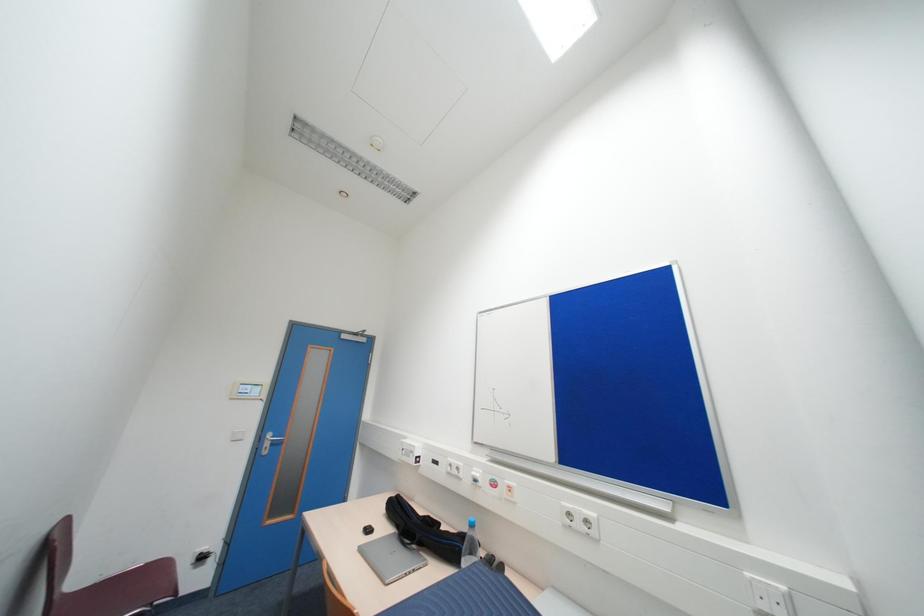
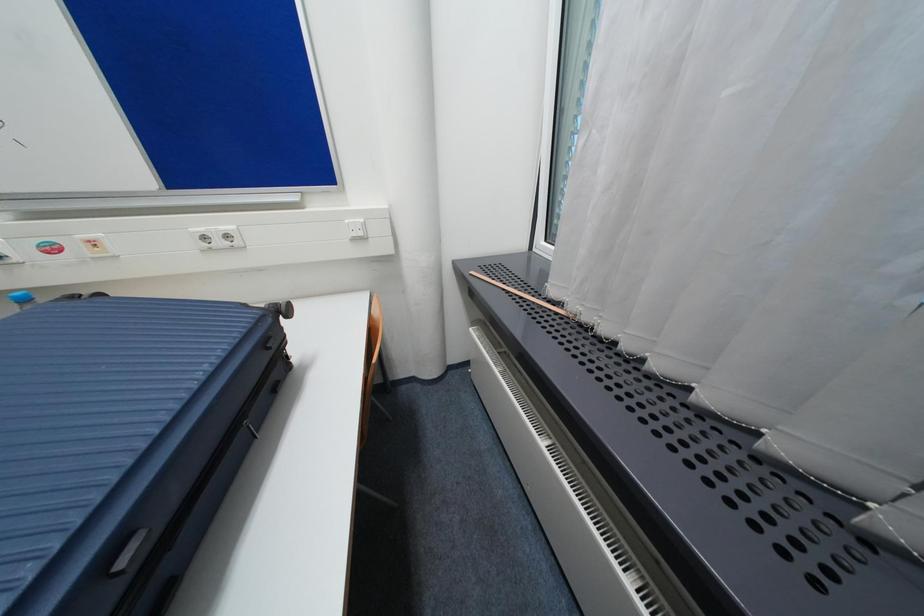
The first image is from the beginning of the video and the second image is from the end. How did the camera likely rotate when shooting the video?

The camera's rotation is toward right-down.